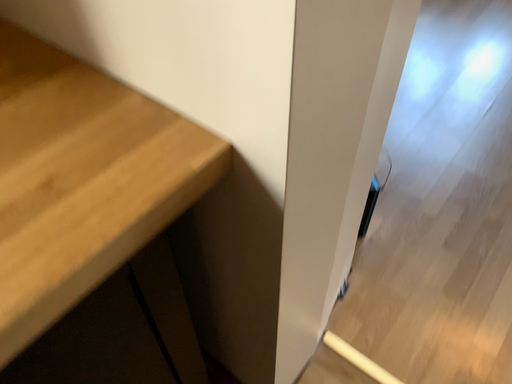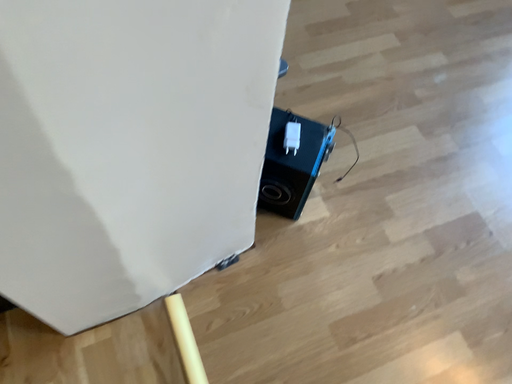
Question: How did the camera likely rotate when shooting the video?

Choices:
 (A) rotated left
 (B) rotated right

Answer: (A)